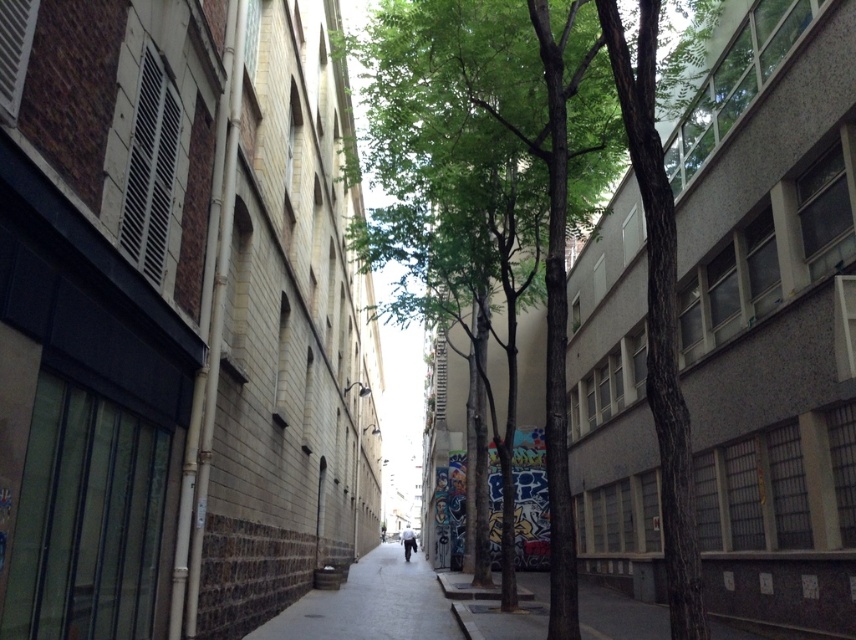
Can you confirm if green rough bark tree at center is taller than gray concrete sidewalk at center?

Correct, green rough bark tree at center is much taller as gray concrete sidewalk at center.

In the scene shown: Measure the distance between point (569,100) and camera.

8.16 meters

Find the location of `green rough bark tree at center`. green rough bark tree at center is located at coordinates (531, 186).

Is green rough bark tree at center wider than white fabric pants at center?

Correct, the width of green rough bark tree at center exceeds that of white fabric pants at center.

Can you confirm if green rough bark tree at center is thinner than white fabric pants at center?

Incorrect, green rough bark tree at center's width is not less than white fabric pants at center's.

Is point (459, 16) behind point (408, 550)?

No.

Find the location of a particular element. green rough bark tree at center is located at coordinates (531, 186).

Who is shorter, gray concrete sidewalk at center or white fabric pants at center?

Standing shorter between the two is gray concrete sidewalk at center.

Does gray concrete sidewalk at center appear under white fabric pants at center?

No, gray concrete sidewalk at center is not below white fabric pants at center.

This screenshot has height=640, width=856. Find the location of `gray concrete sidewalk at center`. gray concrete sidewalk at center is located at coordinates (370, 604).

Where is `gray concrete sidewalk at center`? gray concrete sidewalk at center is located at coordinates (370, 604).